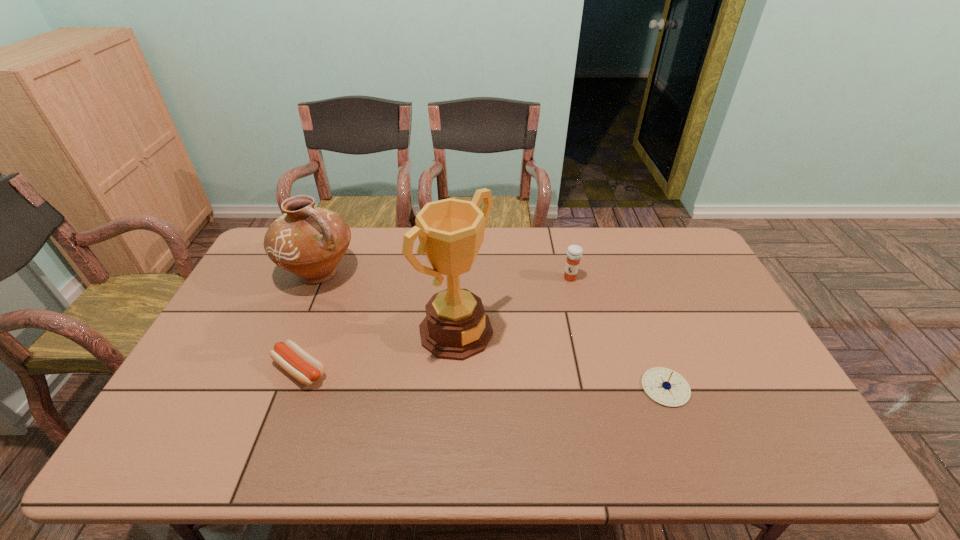
Locate an element on the screen. This screenshot has width=960, height=540. free space located on the side of the fourth shortest object with the handle is located at coordinates (404, 342).

This screenshot has width=960, height=540. I want to click on vacant region located on the side of the fourth shortest object with the handle, so click(411, 347).

Identify the location of free spot located 0.390m on the side of the fourth shortest object with the handle. (420, 355).

The width and height of the screenshot is (960, 540). What are the coordinates of `free region located 0.290m on the front-facing side of the tallest object` in the screenshot? It's located at (570, 413).

This screenshot has height=540, width=960. I want to click on free space located on the front-facing side of the tallest object, so click(x=554, y=401).

You are a GUI agent. You are given a task and a screenshot of the screen. Output one action in this format:
    pyautogui.click(x=<x>, y=<y>)
    Task: Click on the vacant space located on the front-facing side of the tallest object
    The image size is (960, 540).
    Given the screenshot: What is the action you would take?
    pyautogui.click(x=508, y=369)

Locate an element on the screen. The width and height of the screenshot is (960, 540). free space located 0.100m on the label side of the third tallest object is located at coordinates (554, 299).

What are the coordinates of `vacant space situated 0.350m on the label side of the third tallest object` in the screenshot? It's located at (515, 350).

You are a GUI agent. You are given a task and a screenshot of the screen. Output one action in this format:
    pyautogui.click(x=<x>, y=<y>)
    Task: Click on the vacant region located 0.330m on the label side of the third tallest object
    
    Given the screenshot: What is the action you would take?
    pyautogui.click(x=518, y=346)

At what (x,y) coordinates should I click in order to perform the action: click on object at the far edge. Please return your answer as a coordinate pair (x, y). This screenshot has height=540, width=960. Looking at the image, I should click on (308, 241).